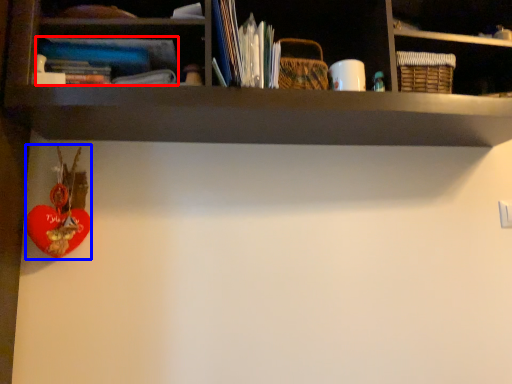
Question: Which of the following is the closest to the observer, book (highlighted by a red box) or toy (highlighted by a blue box)?

Choices:
 (A) book
 (B) toy

Answer: (A)